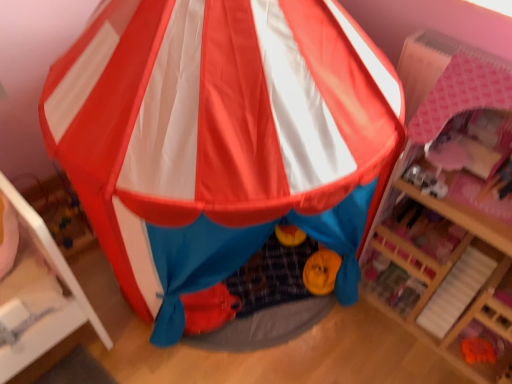
Question: Is pink wood dollhouse at right facing towards matte plastic tent at center?

Choices:
 (A) no
 (B) yes

Answer: (A)

Question: Is pink wood dollhouse at right positioned in front of matte plastic tent at center?

Choices:
 (A) no
 (B) yes

Answer: (A)

Question: From the image's perspective, is pink wood dollhouse at right below matte plastic tent at center?

Choices:
 (A) yes
 (B) no

Answer: (A)

Question: Is pink wood dollhouse at right outside matte plastic tent at center?

Choices:
 (A) no
 (B) yes

Answer: (B)

Question: Is there a large distance between pink wood dollhouse at right and matte plastic tent at center?

Choices:
 (A) yes
 (B) no

Answer: (B)

Question: From a real-world perspective, is pink wood dollhouse at right positioned over matte plastic tent at center based on gravity?

Choices:
 (A) no
 (B) yes

Answer: (A)

Question: Does matte plastic tent at center have a greater height compared to pink wood dollhouse at right?

Choices:
 (A) no
 (B) yes

Answer: (B)

Question: Considering the relative sizes of matte plastic tent at center and pink wood dollhouse at right in the image provided, is matte plastic tent at center bigger than pink wood dollhouse at right?

Choices:
 (A) no
 (B) yes

Answer: (B)

Question: Does matte plastic tent at center have a greater width compared to pink wood dollhouse at right?

Choices:
 (A) yes
 (B) no

Answer: (A)

Question: Is matte plastic tent at center thinner than pink wood dollhouse at right?

Choices:
 (A) yes
 (B) no

Answer: (B)

Question: Is matte plastic tent at center positioned before pink wood dollhouse at right?

Choices:
 (A) no
 (B) yes

Answer: (B)

Question: Could pink wood dollhouse at right be considered to be inside matte plastic tent at center?

Choices:
 (A) yes
 (B) no

Answer: (B)

Question: Is point (474, 241) positioned closer to the camera than point (303, 193)?

Choices:
 (A) closer
 (B) farther

Answer: (B)